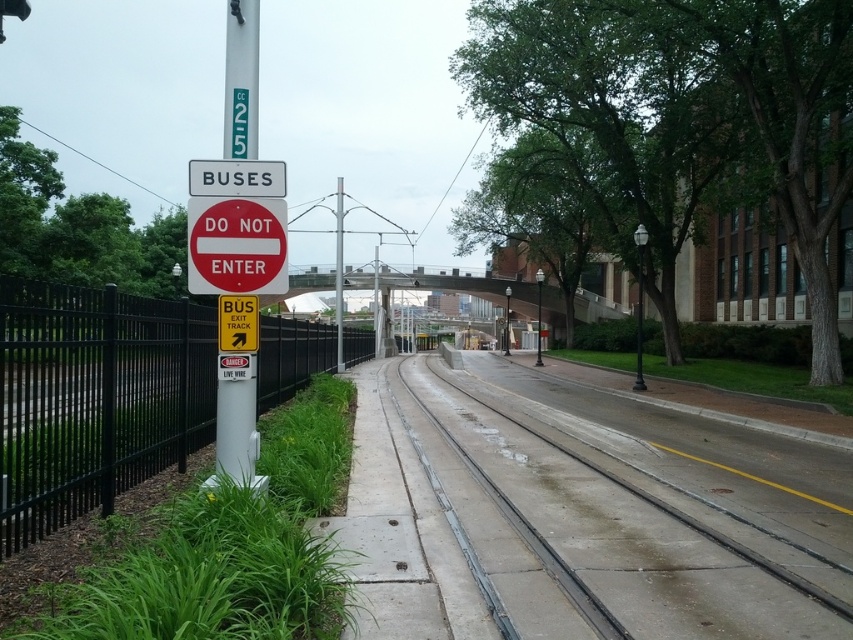
Based on the photo, you are a city planner reviewing the tram area layout. You need to ensure that the white plastic pole at upper center and the metallic pole at center are within the city height regulations. Given that the maximum allowed height for poles in this area is 2.5 meters, can you determine if both poles comply with the regulations based on their heights?

The white plastic pole at upper center has a greater height compared to metallic pole at center. Since the maximum allowed height is 2.5 meters, we need to know the exact heights of both poles to confirm compliance. However, the provided information only states that the white plastic pole at upper center is taller than the metallic pole at center. Without specific measurements, it is impossible to determine if either exceeds the 2.5 meter limit.

You are a delivery driver who needs to exit the bus exit track. The bus exit track is indicated by a yellow sign. You see a point at coordinates (236, 244). What should you avoid based on the signs?

The point at coordinates (236, 244) indicates the red matte do not enter sign at upper left, so you should avoid entering the area marked by the red sign with a white horizontal line through it that says DO NOT ENTER.

You are standing at the tram tracks and want to locate the white plastic pole at center. According to the coordinates provided, in which direction should you look relative to your position?

The white plastic pole at center is located at coordinates point (241, 80). Since the coordinate system typically places the origin at the bottom left corner, the pole is positioned to the right and slightly above your current position at the tram tracks.